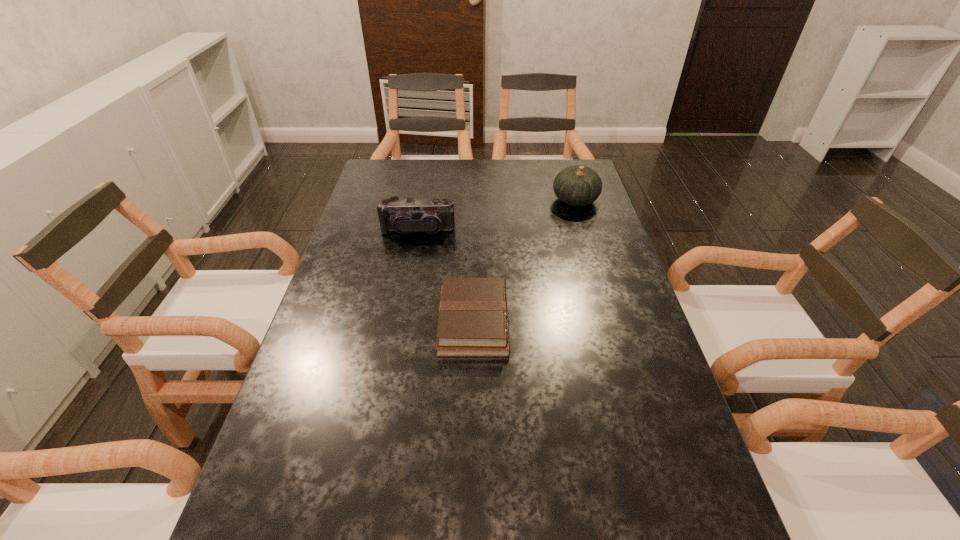
This screenshot has width=960, height=540. In order to click on the rightmost object in this screenshot , I will do `click(577, 185)`.

I want to click on the farthest object, so click(577, 185).

The image size is (960, 540). I want to click on the second nearest object, so click(x=409, y=215).

Identify the location of the second shortest object. (409, 215).

Identify the location of the nearest object. (473, 321).

The width and height of the screenshot is (960, 540). Find the location of `the shortest object`. the shortest object is located at coordinates (473, 321).

Identify the location of free space located 0.270m on the left of the rightmost object. (472, 200).

This screenshot has height=540, width=960. I want to click on blank area located on the front-facing side of the second shortest object, so click(x=409, y=281).

The image size is (960, 540). In order to click on vacant space positioned 0.290m on the spine side of the Bible in this screenshot , I will do `click(626, 322)`.

Find the location of `object situated at the far edge`. object situated at the far edge is located at coordinates (577, 185).